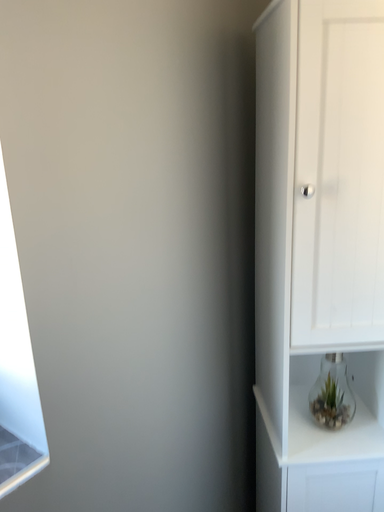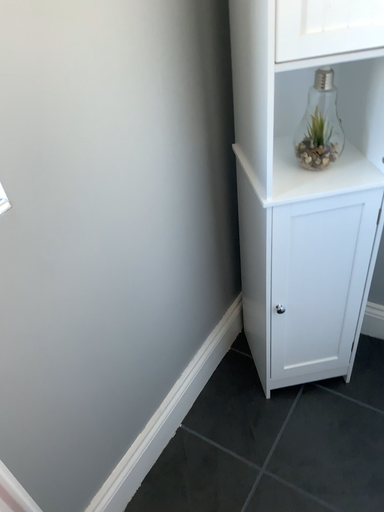
Question: Which way did the camera rotate in the video?

Choices:
 (A) rotated upward
 (B) rotated downward

Answer: (B)